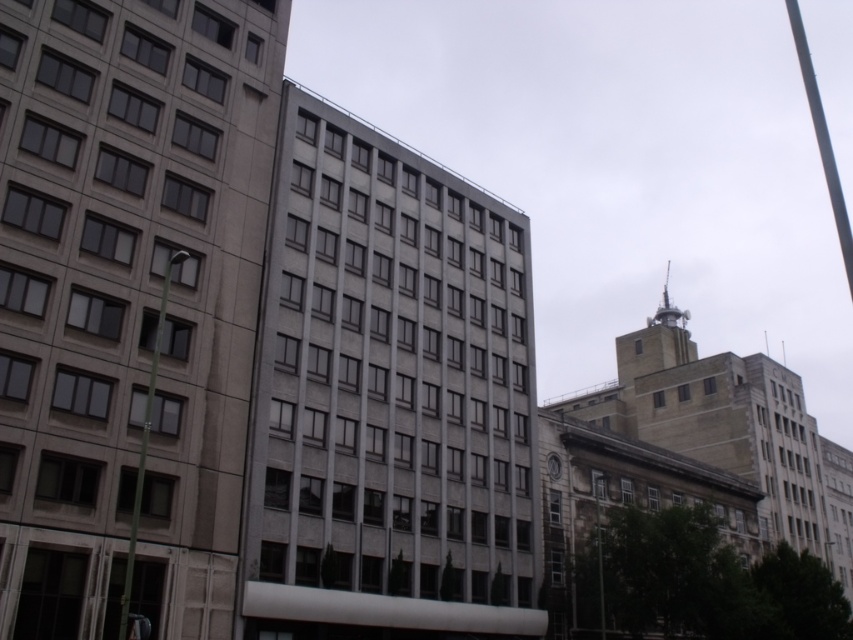
From the picture: Does green metallic pole at left appear on the left side of white marble clock at center?

Correct, you'll find green metallic pole at left to the left of white marble clock at center.

Which of these two, green metallic pole at left or white marble clock at center, stands taller?

green metallic pole at left

Is point (119, 611) farther from viewer compared to point (547, 465)?

No, (119, 611) is in front of (547, 465).

Image resolution: width=853 pixels, height=640 pixels. Find the location of `green metallic pole at left`. green metallic pole at left is located at coordinates (144, 444).

Is point (380, 349) behind point (122, 627)?

Yes, point (380, 349) is behind point (122, 627).

Can you confirm if gray concrete building at center is positioned below green metallic pole at left?

No.

Who is more forward, (343, 499) or (125, 592)?

Point (125, 592) is in front.

Where is `gray concrete building at center`? The image size is (853, 640). gray concrete building at center is located at coordinates (387, 397).

Does gray concrete building at left come behind green metallic pole at left?

Yes, it is.

Which is behind, point (80, 384) or point (131, 554)?

Positioned behind is point (80, 384).

Does point (169, 301) come farther from viewer compared to point (163, 285)?

No.

The width and height of the screenshot is (853, 640). I want to click on gray concrete building at left, so click(128, 301).